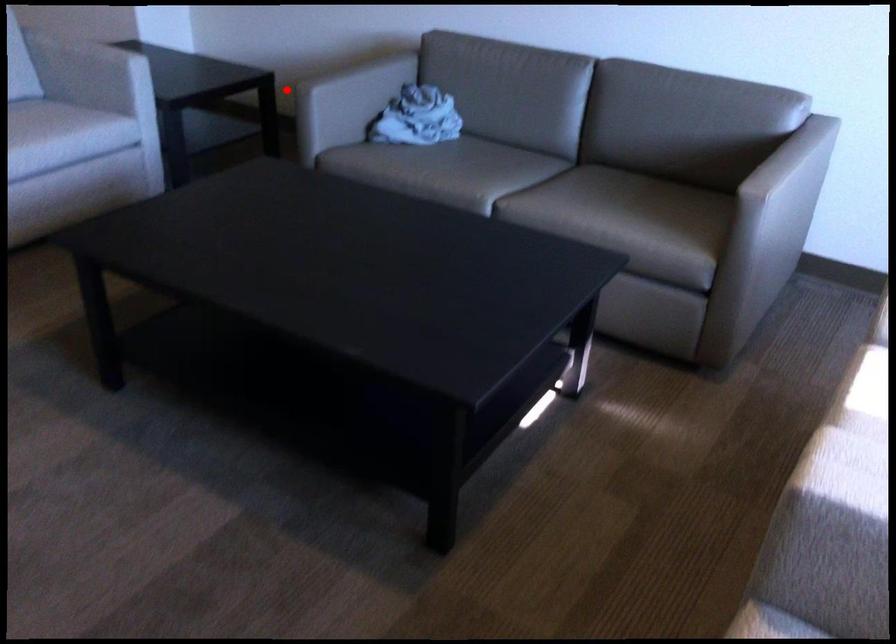
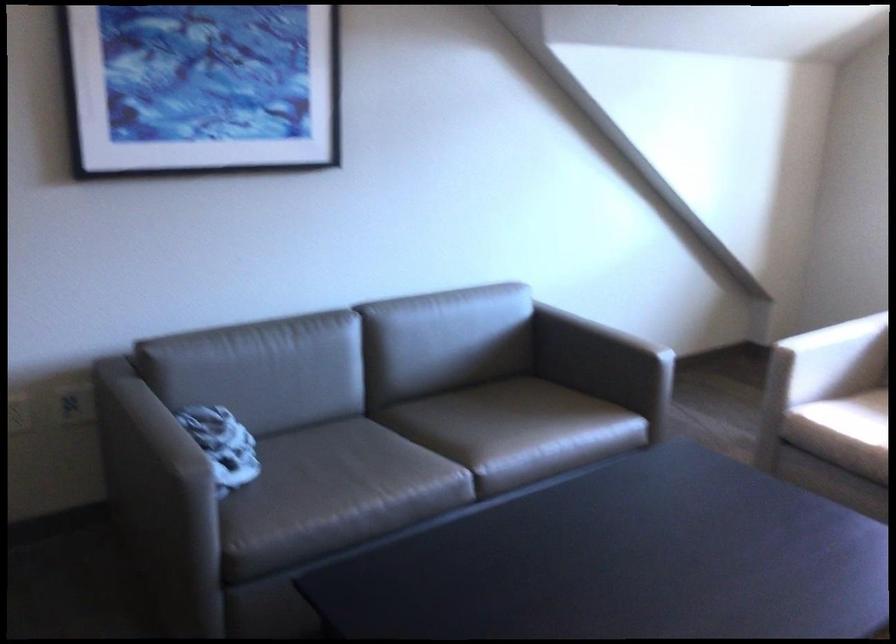
Locate, in the second image, the point that corresponds to the highlighted location in the first image.

(158, 491)